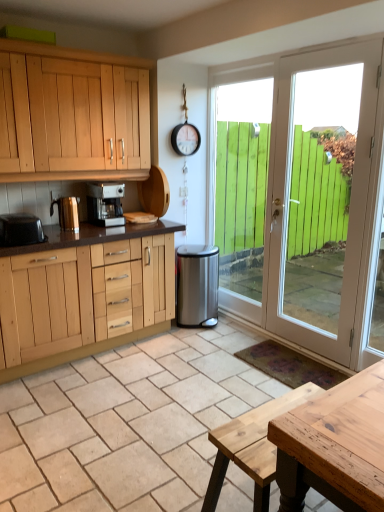
Question: In the image, is natural stone tile at center positioned in front of or behind natural wood picnic table at center?

Choices:
 (A) front
 (B) behind

Answer: (A)

Question: Does point (43, 498) appear closer or farther from the camera than point (210, 435)?

Choices:
 (A) farther
 (B) closer

Answer: (A)

Question: Which object is positioned farthest from the green wooden door at right?

Choices:
 (A) white wood door at right
 (B) satin silver coffee machine at upper center
 (C) polished gold kettle at left, positioned as the 2th appliance in back-to-front order
 (D) stainless steel trash can at center, which ranks as the 1th appliance in back-to-front order
 (E) natural wood picnic table at center

Answer: (E)

Question: Which of these objects is positioned closest to the black plastic toaster at left, which appears as the 3th appliance when viewed from the back?

Choices:
 (A) natural stone tile at center
 (B) stainless steel trash can at center, acting as the 3th appliance starting from the front
 (C) natural wood picnic table at center
 (D) polished gold kettle at left, the 2th appliance positioned from the right
 (E) green wooden door at right

Answer: (D)